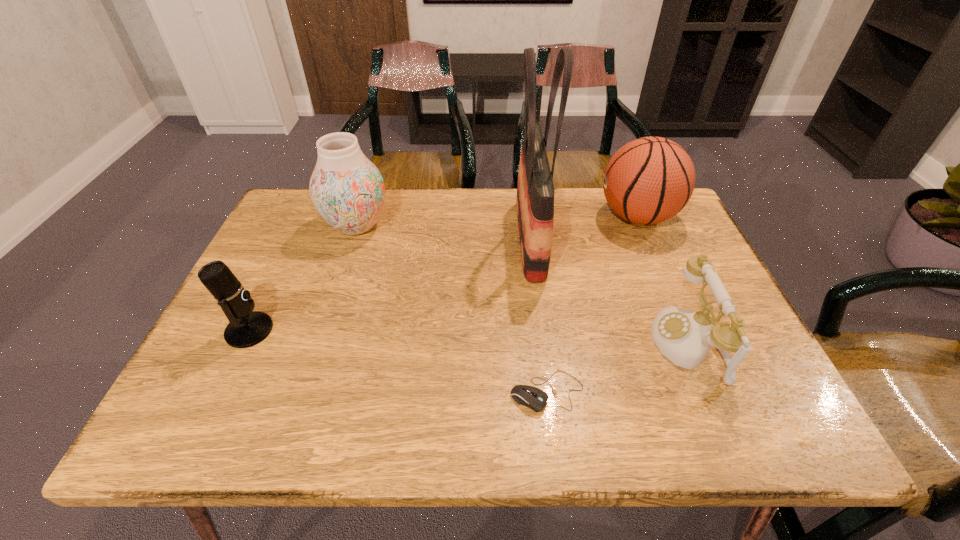
In the image, there is a desktop. In order to click on vacant space at the left edge in this screenshot , I will do `click(228, 350)`.

Where is `vacant position at the right edge of the desktop`? vacant position at the right edge of the desktop is located at coordinates (752, 390).

Where is `blank space at the far left corner`? blank space at the far left corner is located at coordinates (288, 203).

What are the coordinates of `free location at the far right corner` in the screenshot? It's located at (651, 231).

The height and width of the screenshot is (540, 960). I want to click on vacant space that's between the microphone and the shopping bag, so click(390, 285).

Find the location of a particular element. The image size is (960, 540). free space between the fifth object from right to left and the leftmost object is located at coordinates (302, 278).

I want to click on free spot between the shopping bag and the leftmost object, so click(390, 285).

Locate an element on the screen. The height and width of the screenshot is (540, 960). unoccupied position between the vase and the tallest object is located at coordinates (444, 232).

Where is `free space between the computer mouse and the microphone`? The width and height of the screenshot is (960, 540). free space between the computer mouse and the microphone is located at coordinates (398, 361).

At what (x,y) coordinates should I click in order to perform the action: click on free space between the tallest object and the fifth object from right to left. Please return your answer as a coordinate pair (x, y). Looking at the image, I should click on (444, 232).